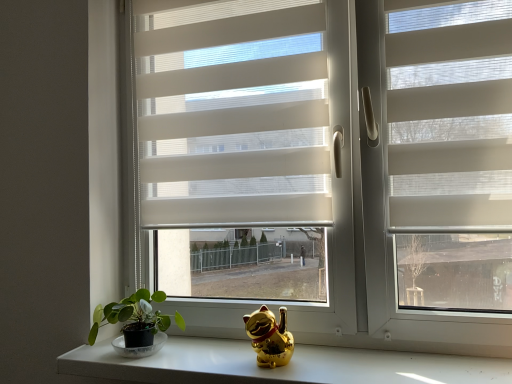
Find the location of a particular element. free space between green matte plant at lower left and gold shiny cat at center is located at coordinates (209, 361).